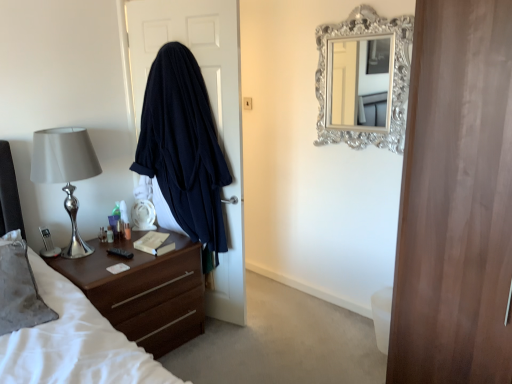
The width and height of the screenshot is (512, 384). I want to click on empty space that is to the right of black plastic remote control at left, so click(143, 260).